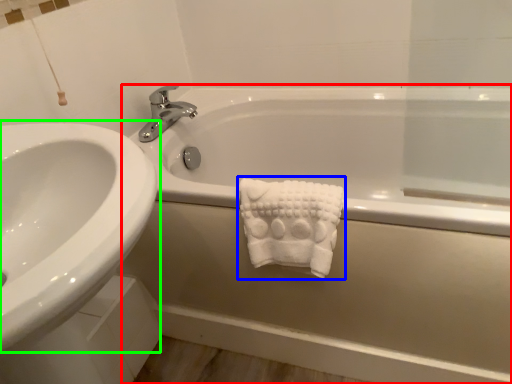
Question: Based on their relative distances, which object is nearer to bathtub (highlighted by a red box)? Choose from bath towel (highlighted by a blue box) and sink (highlighted by a green box).

Choices:
 (A) bath towel
 (B) sink

Answer: (A)